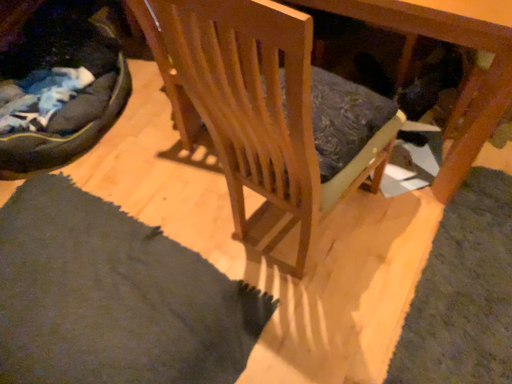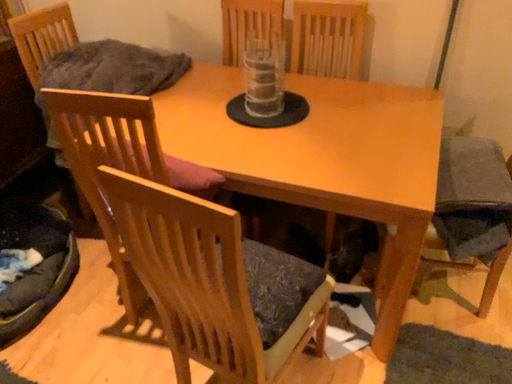
Question: Which way did the camera rotate in the video?

Choices:
 (A) rotated right
 (B) rotated left

Answer: (A)